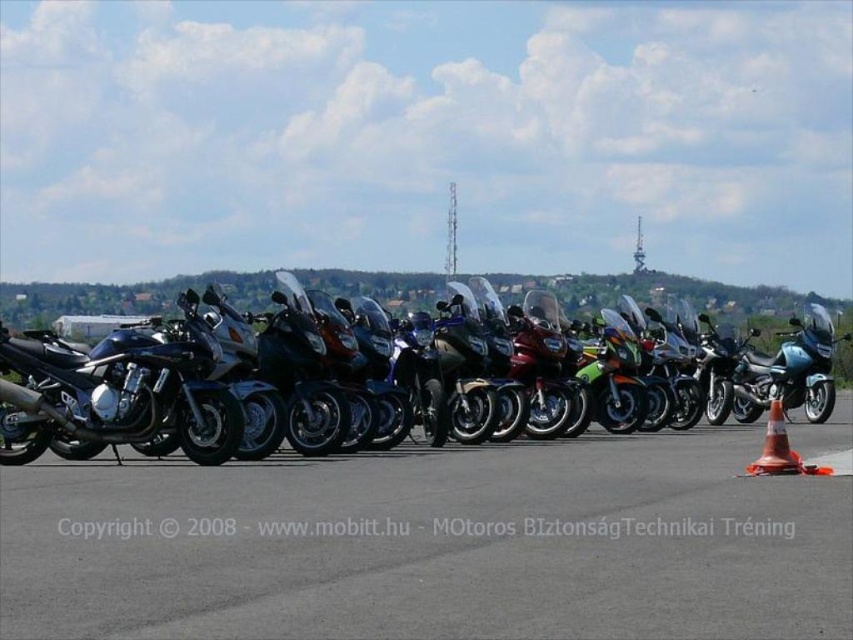
Question: Which of these objects is positioned farthest from the shiny chrome motorcycle at center?

Choices:
 (A) metallic motorcycles at center
 (B) orange reflective cone at lower right

Answer: (B)

Question: Can you confirm if metallic motorcycles at center is smaller than shiny chrome motorcycle at center?

Choices:
 (A) no
 (B) yes

Answer: (B)

Question: Is metallic motorcycles at center above orange reflective cone at lower right?

Choices:
 (A) no
 (B) yes

Answer: (A)

Question: Does metallic motorcycles at center have a greater width compared to shiny chrome motorcycle at center?

Choices:
 (A) no
 (B) yes

Answer: (A)

Question: Which point appears farthest from the camera in this image?

Choices:
 (A) (770, 422)
 (B) (598, 284)

Answer: (B)

Question: Which of the following is the farthest from the observer?

Choices:
 (A) (776, 470)
 (B) (772, 323)

Answer: (B)